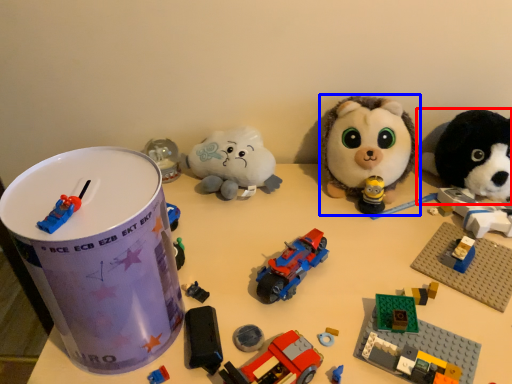
Question: Which object appears farthest to the camera in this image, toy (highlighted by a red box) or toy (highlighted by a blue box)?

Choices:
 (A) toy
 (B) toy

Answer: (B)